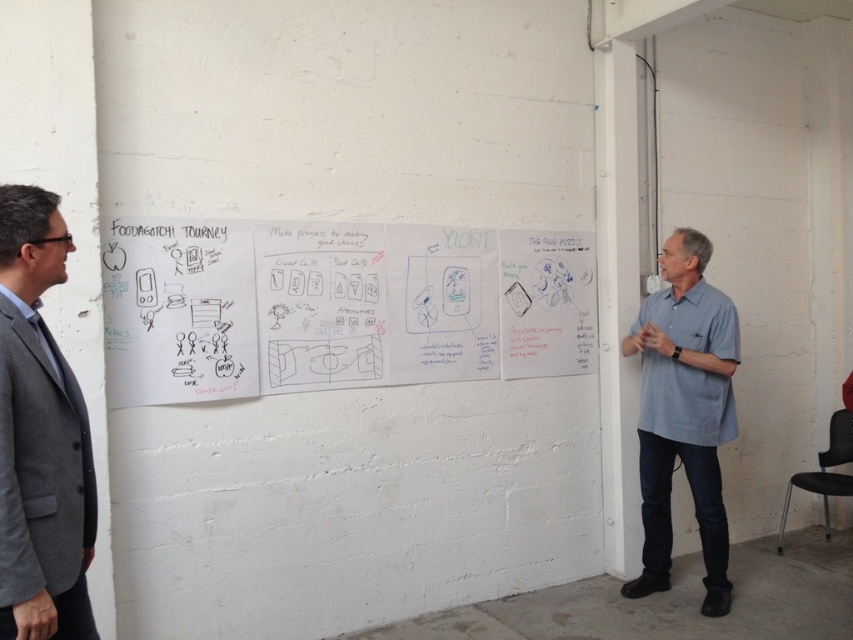
Does white paper at center have a smaller size compared to gray wool suit at left?

Actually, white paper at center might be larger than gray wool suit at left.

Does white paper at center have a lesser width compared to gray wool suit at left?

Incorrect, white paper at center's width is not less than gray wool suit at left's.

Who is more forward, [141,280] or [74,556]?

Positioned in front is point [74,556].

Identify the location of white paper at center. (337, 307).

In the scene shown: Does white paper at center lie in front of light blue shirt at right?

Yes, white paper at center is closer to the viewer.

Which is more to the left, white paper at center or light blue shirt at right?

From the viewer's perspective, white paper at center appears more on the left side.

What do you see at coordinates (337, 307) in the screenshot? I see `white paper at center` at bounding box center [337, 307].

This screenshot has height=640, width=853. Find the location of `white paper at center`. white paper at center is located at coordinates (337, 307).

Is gray wool suit at left positioned at the back of light blue shirt at right?

No, gray wool suit at left is in front of light blue shirt at right.

Who is positioned more to the left, gray wool suit at left or light blue shirt at right?

From the viewer's perspective, gray wool suit at left appears more on the left side.

Between point (45, 566) and point (646, 348), which one is positioned in front?

Point (45, 566) is more forward.

Locate an element on the screen. Image resolution: width=853 pixels, height=640 pixels. gray wool suit at left is located at coordinates (39, 435).